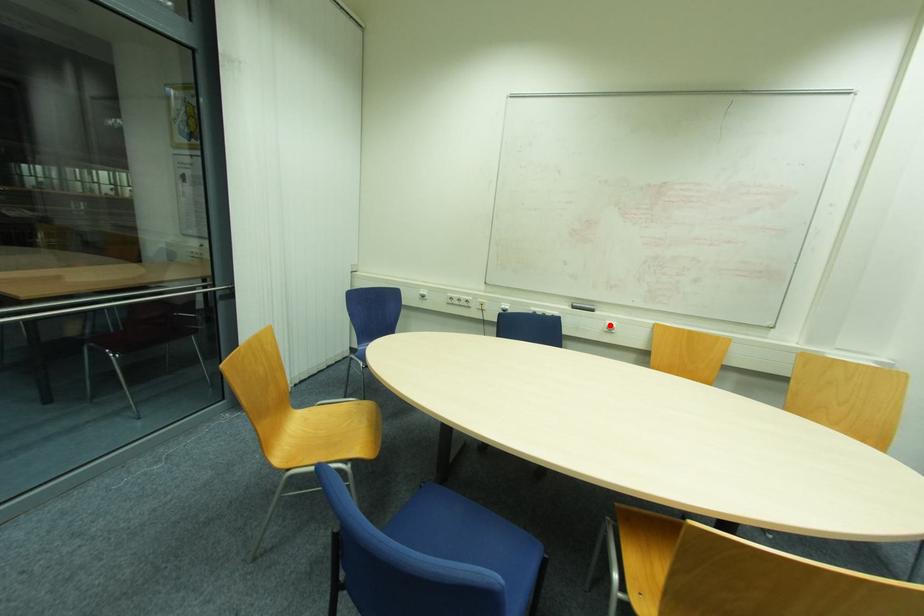
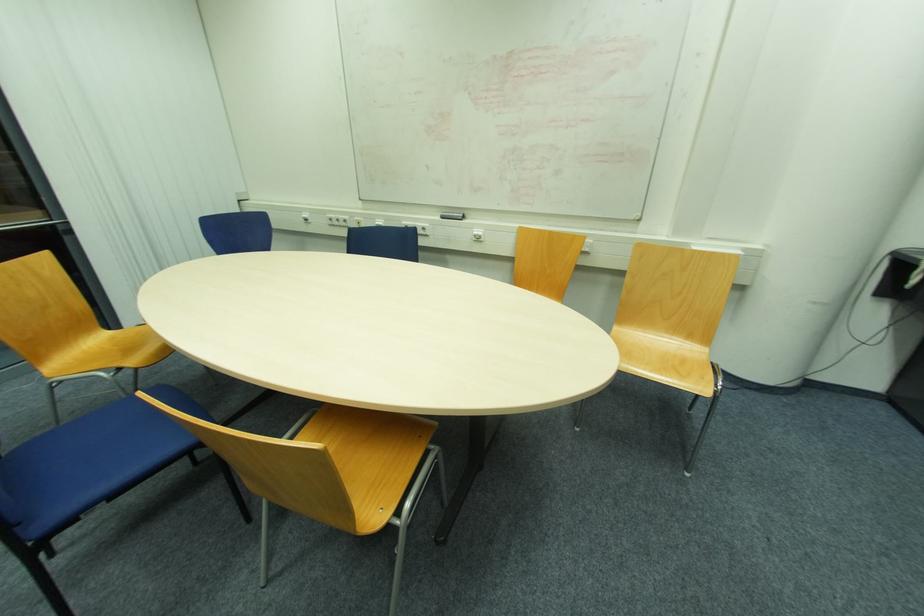
Locate, in the second image, the point that corresponds to the highlighted location in the first image.

(477, 233)